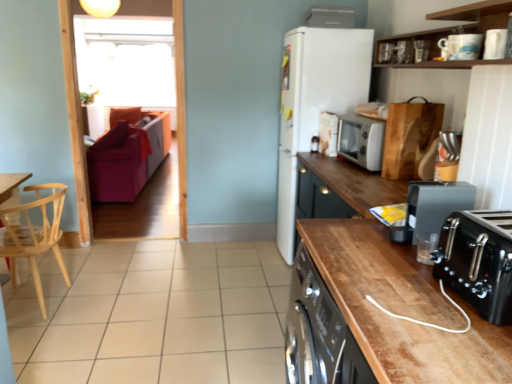
Question: Considering the relative sizes of white glossy microwave at upper right, which is counted as the first appliance, starting from the bottom, and light wood chair at left in the image provided, is white glossy microwave at upper right, which is counted as the first appliance, starting from the bottom, shorter than light wood chair at left?

Choices:
 (A) yes
 (B) no

Answer: (A)

Question: From a real-world perspective, is white glossy microwave at upper right, the 1th appliance in the left-to-right sequence, located higher than light wood chair at left?

Choices:
 (A) no
 (B) yes

Answer: (B)

Question: Is white glossy microwave at upper right, which is the 6th appliance from top to bottom, at the right side of light wood chair at left?

Choices:
 (A) yes
 (B) no

Answer: (A)

Question: Is white glossy microwave at upper right, the 1th appliance in the left-to-right sequence, facing away from light wood chair at left?

Choices:
 (A) no
 (B) yes

Answer: (A)

Question: From a real-world perspective, is white glossy microwave at upper right, which is counted as the first appliance, starting from the bottom, physically below light wood chair at left?

Choices:
 (A) no
 (B) yes

Answer: (A)

Question: Is matte white coffee maker at upper center, the first appliance from the top, inside or outside of silver metallic microwave at upper right, which is the third kitchen appliance from front to back?

Choices:
 (A) inside
 (B) outside

Answer: (B)

Question: Looking at their shapes, would you say matte white coffee maker at upper center, which is counted as the 6th appliance, starting from the bottom, is wider or thinner than silver metallic microwave at upper right, placed as the 3th kitchen appliance when sorted from bottom to top?

Choices:
 (A) wide
 (B) thin

Answer: (B)

Question: From a real-world perspective, relative to silver metallic microwave at upper right, which is the third kitchen appliance from front to back, is matte white coffee maker at upper center, which is counted as the 6th appliance, starting from the bottom, vertically above or below?

Choices:
 (A) below
 (B) above

Answer: (B)

Question: From the image's perspective, relative to silver metallic microwave at upper right, which is the third kitchen appliance from front to back, is matte white coffee maker at upper center, marked as the first appliance in a back-to-front arrangement, above or below?

Choices:
 (A) above
 (B) below

Answer: (A)

Question: Considering their positions, is silver metallic microwave at upper right, which appears as the first kitchen appliance when viewed from the back, located in front of or behind white glossy mug at upper center, the 2th appliance from the front?

Choices:
 (A) front
 (B) behind

Answer: (B)

Question: Considering the positions of silver metallic microwave at upper right, which is the third kitchen appliance from front to back, and white glossy mug at upper center, the 4th appliance in the top-to-bottom sequence, in the image, is silver metallic microwave at upper right, which is the third kitchen appliance from front to back, wider or thinner than white glossy mug at upper center, the 4th appliance in the top-to-bottom sequence,?

Choices:
 (A) thin
 (B) wide

Answer: (B)

Question: Is silver metallic microwave at upper right, which is the third kitchen appliance from front to back, spatially inside white glossy mug at upper center, marked as the 2th appliance in a left-to-right arrangement, or outside of it?

Choices:
 (A) inside
 (B) outside

Answer: (B)

Question: Considering the positions of silver metallic microwave at upper right, which is the third kitchen appliance from front to back, and white glossy mug at upper center, the 2th appliance from the front, in the image, is silver metallic microwave at upper right, which is the third kitchen appliance from front to back, bigger or smaller than white glossy mug at upper center, the 2th appliance from the front,?

Choices:
 (A) small
 (B) big

Answer: (B)

Question: Does point (318, 122) appear closer or farther from the camera than point (408, 46)?

Choices:
 (A) farther
 (B) closer

Answer: (A)

Question: Is white glossy microwave at upper right, the 5th appliance in the front-to-back sequence, in front of or behind metallic silver toaster at upper right, placed as the 4th appliance when sorted from front to back, in the image?

Choices:
 (A) front
 (B) behind

Answer: (B)